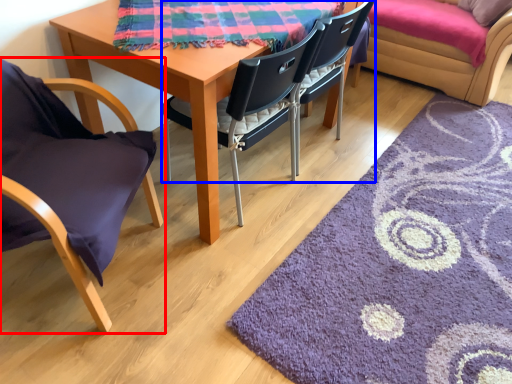
Question: Which object is further to the camera taking this photo, chair (highlighted by a red box) or chair (highlighted by a blue box)?

Choices:
 (A) chair
 (B) chair

Answer: (B)